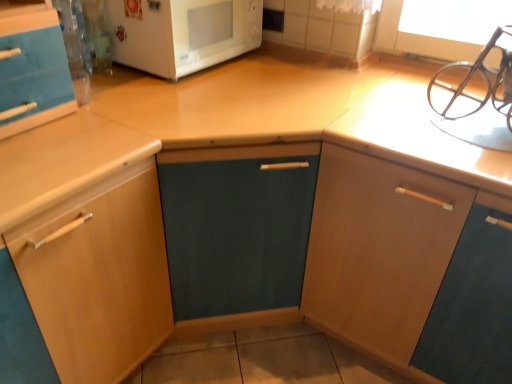
The width and height of the screenshot is (512, 384). What are the coordinates of `vacant area on top of wooden cabinet at upper right, the 1th cabinetry viewed from the right (from a real-world perspective)` in the screenshot? It's located at (449, 119).